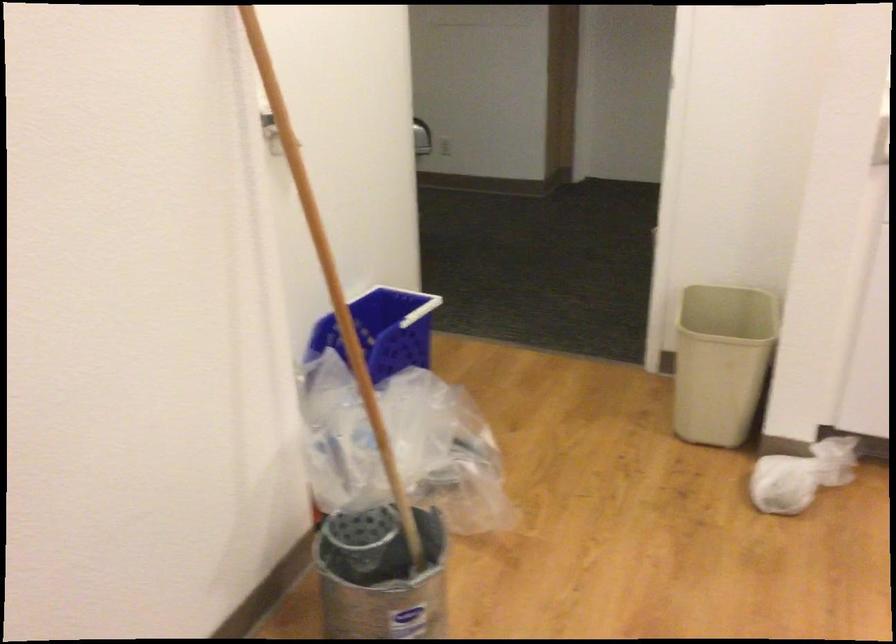
You are a GUI agent. You are given a task and a screenshot of the screen. Output one action in this format:
    pyautogui.click(x=<x>, y=<y>)
    Task: Click on the blue basket handle
    This screenshot has width=896, height=644.
    Given the screenshot: What is the action you would take?
    pyautogui.click(x=407, y=303)